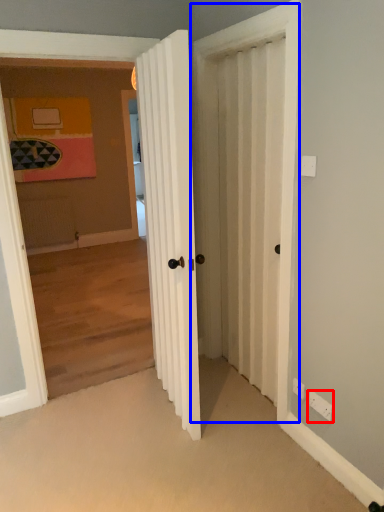
Question: Which object is further to the camera taking this photo, electric outlet (highlighted by a red box) or screen door (highlighted by a blue box)?

Choices:
 (A) electric outlet
 (B) screen door

Answer: (A)